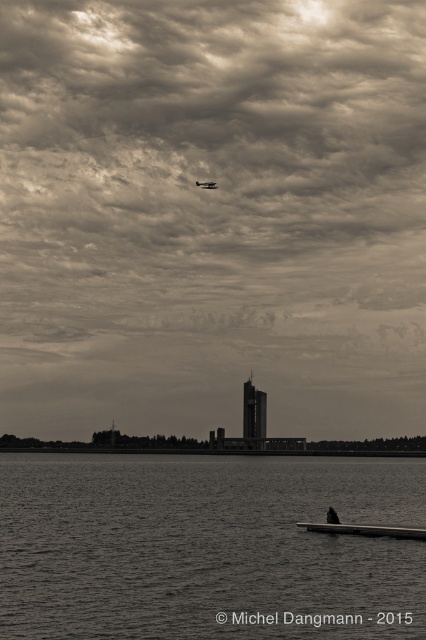
Does point (357, 56) come closer to viewer compared to point (278, 436)?

No.

Does cloudy sky at upper center come in front of smooth concrete horizon at center?

No, cloudy sky at upper center is behind smooth concrete horizon at center.

Locate an element on the screen. cloudy sky at upper center is located at coordinates (212, 214).

Does cloudy sky at upper center have a lesser width compared to smooth water at lower left?

No, cloudy sky at upper center is not thinner than smooth water at lower left.

Between point (314, 13) and point (55, 573), which one is positioned behind?

The point (314, 13) is behind.

Is point (367, 49) positioned before point (147, 564)?

No, it is not.

Identify the location of cloudy sky at upper center. Image resolution: width=426 pixels, height=640 pixels. (212, 214).

You are a GUI agent. You are given a task and a screenshot of the screen. Output one action in this format:
    pyautogui.click(x=<x>, y=<y>)
    Task: Click on the cloudy sky at upper center
    This screenshot has width=426, height=640.
    Given the screenshot: What is the action you would take?
    pyautogui.click(x=212, y=214)

Is the position of cloudy sky at upper center more distant than that of metallic silver seaplane at upper center?

No, cloudy sky at upper center is closer to the viewer.

Locate an element on the screen. cloudy sky at upper center is located at coordinates (212, 214).